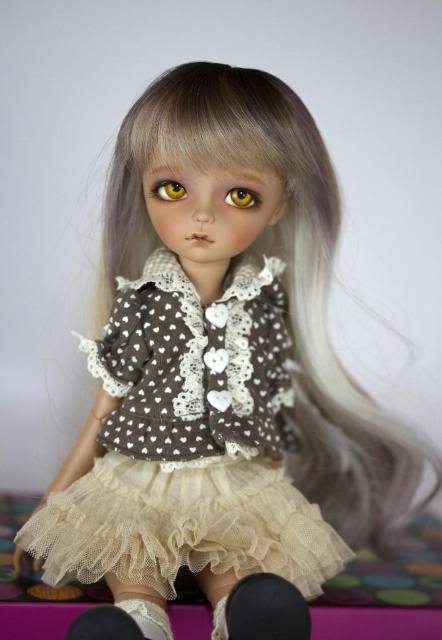
Question: Which object appears farthest from the camera in this image?

Choices:
 (A) brown glossy eye at center
 (B) white lace dress at center
 (C) brown glossy eye at upper center

Answer: (A)

Question: Which point is closer to the camera taking this photo?

Choices:
 (A) (246, 192)
 (B) (153, 182)

Answer: (A)

Question: Considering the relative positions of white lace dress at center and brown glossy eye at center in the image provided, where is white lace dress at center located with respect to brown glossy eye at center?

Choices:
 (A) below
 (B) above

Answer: (A)

Question: Is brown glossy eye at upper center to the right of brown glossy eye at center from the viewer's perspective?

Choices:
 (A) no
 (B) yes

Answer: (A)

Question: Estimate the real-world distances between objects in this image. Which object is farther from the white lace dress at center?

Choices:
 (A) brown glossy eye at upper center
 (B) brown glossy eye at center

Answer: (A)

Question: Does brown glossy eye at upper center have a lesser width compared to brown glossy eye at center?

Choices:
 (A) no
 (B) yes

Answer: (A)